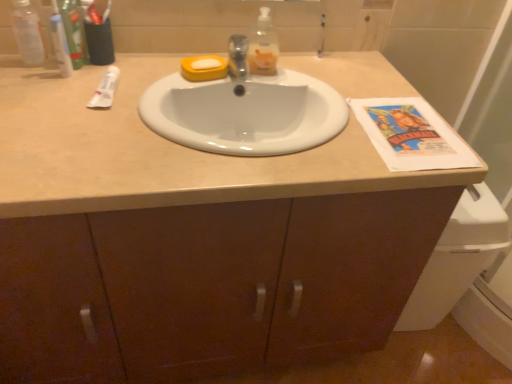
Question: From the image's perspective, would you say green plastic toothpaste tube at upper left, which ranks as the first toiletry in left-to-right order, is shown under white glossy sink at center?

Choices:
 (A) no
 (B) yes

Answer: (A)

Question: Are green plastic toothpaste tube at upper left, placed as the 2th toiletry when sorted from right to left, and white glossy sink at center located far from each other?

Choices:
 (A) yes
 (B) no

Answer: (B)

Question: Can we say green plastic toothpaste tube at upper left, placed as the 2th toiletry when sorted from right to left, lies outside white glossy sink at center?

Choices:
 (A) no
 (B) yes

Answer: (B)

Question: Does green plastic toothpaste tube at upper left, placed as the 2th toiletry when sorted from right to left, appear on the right side of white glossy sink at center?

Choices:
 (A) yes
 (B) no

Answer: (B)

Question: Is white glossy sink at center surrounded by green plastic toothpaste tube at upper left, which ranks as the first toiletry in left-to-right order?

Choices:
 (A) no
 (B) yes

Answer: (A)

Question: From a real-world perspective, relative to green plastic toothpaste tube at upper left, placed as the 2th toiletry when sorted from right to left, is transparent plastic bottle at upper left, the first bottle in the left-to-right sequence, vertically above or below?

Choices:
 (A) below
 (B) above

Answer: (A)

Question: From their relative heights in the image, would you say transparent plastic bottle at upper left, the first bottle in the left-to-right sequence, is taller or shorter than green plastic toothpaste tube at upper left, placed as the 2th toiletry when sorted from right to left?

Choices:
 (A) short
 (B) tall

Answer: (A)

Question: In terms of size, does transparent plastic bottle at upper left, acting as the 2th bottle starting from the right, appear bigger or smaller than green plastic toothpaste tube at upper left, placed as the 2th toiletry when sorted from right to left?

Choices:
 (A) big
 (B) small

Answer: (B)

Question: Is transparent plastic bottle at upper left, acting as the 2th bottle starting from the right, spatially inside green plastic toothpaste tube at upper left, which ranks as the first toiletry in left-to-right order, or outside of it?

Choices:
 (A) inside
 (B) outside

Answer: (B)

Question: Relative to white matte tube at upper left, is transparent plastic bottle at upper left, the first bottle in the left-to-right sequence, in front or behind?

Choices:
 (A) front
 (B) behind

Answer: (B)

Question: From their relative heights in the image, would you say transparent plastic bottle at upper left, the first bottle in the left-to-right sequence, is taller or shorter than white matte tube at upper left?

Choices:
 (A) tall
 (B) short

Answer: (A)

Question: Is transparent plastic bottle at upper left, the first bottle in the left-to-right sequence, inside the boundaries of white matte tube at upper left, or outside?

Choices:
 (A) outside
 (B) inside

Answer: (A)

Question: Is point (31, 16) positioned closer to the camera than point (113, 94)?

Choices:
 (A) farther
 (B) closer

Answer: (A)

Question: Is white glossy sink at center inside or outside of translucent plastic soap dispenser at upper center, placed as the first bottle when sorted from right to left?

Choices:
 (A) inside
 (B) outside

Answer: (B)

Question: Based on their sizes in the image, would you say white glossy sink at center is bigger or smaller than translucent plastic soap dispenser at upper center, placed as the first bottle when sorted from right to left?

Choices:
 (A) big
 (B) small

Answer: (A)